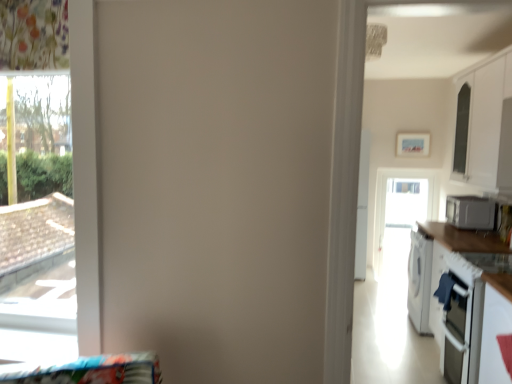
Question: Considering the relative sizes of transparent glass window at left and white glossy cabinet at upper right in the image provided, is transparent glass window at left bigger than white glossy cabinet at upper right?

Choices:
 (A) yes
 (B) no

Answer: (B)

Question: Is transparent glass window at left shorter than white glossy cabinet at upper right?

Choices:
 (A) no
 (B) yes

Answer: (A)

Question: From a real-world perspective, is transparent glass window at left on white glossy cabinet at upper right?

Choices:
 (A) yes
 (B) no

Answer: (B)

Question: Is transparent glass window at left beside white glossy cabinet at upper right?

Choices:
 (A) no
 (B) yes

Answer: (A)

Question: Is transparent glass window at left to the left of white glossy cabinet at upper right from the viewer's perspective?

Choices:
 (A) yes
 (B) no

Answer: (A)

Question: Does transparent glass window at left have a smaller size compared to white glossy cabinet at upper right?

Choices:
 (A) no
 (B) yes

Answer: (B)

Question: Considering the relative sizes of white glossy countertop at right and transparent glass screen door at center in the image provided, is white glossy countertop at right bigger than transparent glass screen door at center?

Choices:
 (A) no
 (B) yes

Answer: (B)

Question: From the image's perspective, does white glossy countertop at right appear lower than transparent glass screen door at center?

Choices:
 (A) no
 (B) yes

Answer: (B)

Question: Is white glossy countertop at right not close to transparent glass screen door at center?

Choices:
 (A) no
 (B) yes

Answer: (B)

Question: Is white glossy countertop at right to the right of transparent glass screen door at center from the viewer's perspective?

Choices:
 (A) yes
 (B) no

Answer: (B)

Question: Is white glossy countertop at right facing away from transparent glass screen door at center?

Choices:
 (A) no
 (B) yes

Answer: (A)

Question: Can you confirm if white glossy countertop at right is wider than transparent glass screen door at center?

Choices:
 (A) yes
 (B) no

Answer: (A)

Question: From the image's perspective, is transparent glass window at left on top of satin silver microwave at right?

Choices:
 (A) yes
 (B) no

Answer: (A)